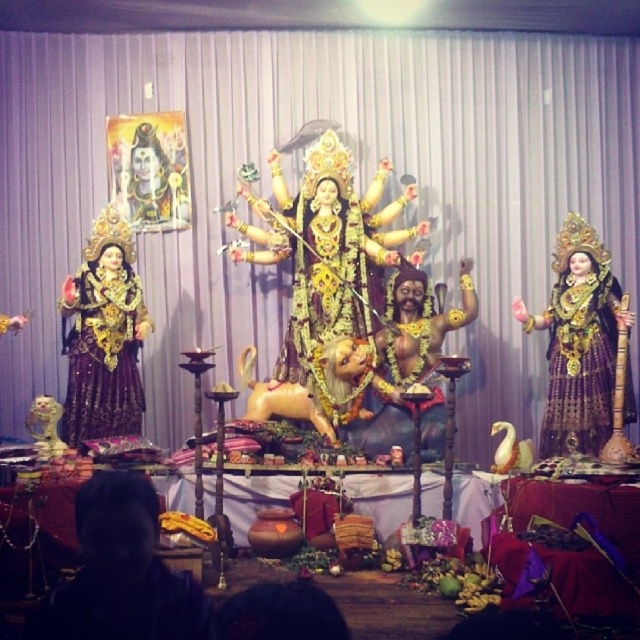
Question: Which object appears closest to the camera in this image?

Choices:
 (A) dark fabric headscarf at lower left
 (B) golden painted portrait at upper left
 (C) matte gold statue at right

Answer: (A)

Question: Is gold/golden statue at center wider than matte gold statue at left?

Choices:
 (A) yes
 (B) no

Answer: (B)

Question: Is gold/golden statue at center positioned before matte gold statue at left?

Choices:
 (A) no
 (B) yes

Answer: (A)

Question: Among these points, which one is nearest to the camera?

Choices:
 (A) pyautogui.click(x=564, y=340)
 (B) pyautogui.click(x=61, y=284)
 (C) pyautogui.click(x=305, y=342)

Answer: (A)

Question: Is matte gold statue at right above matte gold statue at left?

Choices:
 (A) yes
 (B) no

Answer: (B)

Question: Which object is positioned farthest from the gold/golden statue at center?

Choices:
 (A) matte gold statue at left
 (B) matte gold statue at right

Answer: (A)